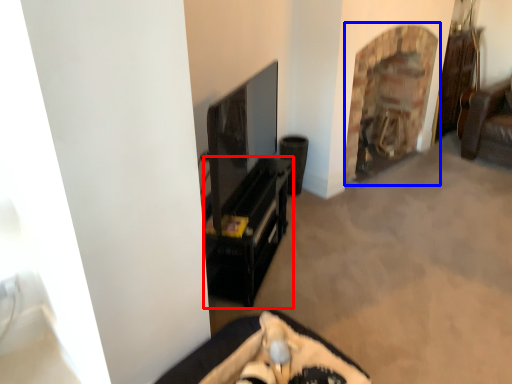
Question: Which object is further to the camera taking this photo, furniture (highlighted by a red box) or fireplace (highlighted by a blue box)?

Choices:
 (A) furniture
 (B) fireplace

Answer: (B)